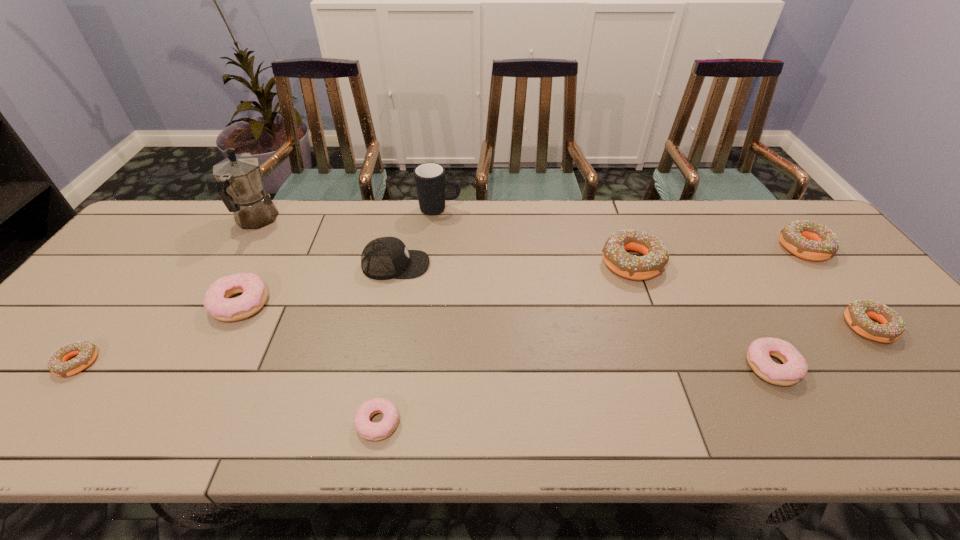
You are a GUI agent. You are given a task and a screenshot of the screen. Output one action in this format:
    pyautogui.click(x=<x>, y=<y>)
    Task: Click on the vacant region between the nearest doughnut and the second nearest chocolate doughnut
    This screenshot has width=960, height=540.
    Given the screenshot: What is the action you would take?
    pyautogui.click(x=623, y=375)

At what (x,y) coordinates should I click in order to perform the action: click on vacant area that lies between the tallest object and the mug. Please return your answer as a coordinate pair (x, y). Looking at the image, I should click on (348, 215).

Find the location of `unoccupied position between the biggest pink doughnut and the biggest chocolate doughnut`. unoccupied position between the biggest pink doughnut and the biggest chocolate doughnut is located at coordinates (436, 283).

This screenshot has width=960, height=540. I want to click on free space between the nearest doughnut and the eighth object from left to right, so click(574, 394).

Find the location of a particular element. Image resolution: width=960 pixels, height=540 pixels. free space between the third object from right to left and the eighth shortest object is located at coordinates (584, 315).

Locate which object is the fifth closest to the smallest pink doughnut. Please provide its 2D coordinates. Your answer should be formatted as a tuple, i.e. [(x, y)], where the tuple contains the x and y coordinates of a point satisfying the conditions above.

[(430, 180)]

This screenshot has height=540, width=960. I want to click on object that stands as the seventh closest to the second smallest pink doughnut, so click(216, 301).

You are a GUI agent. You are given a task and a screenshot of the screen. Output one action in this format:
    pyautogui.click(x=<x>, y=<y>)
    Task: Click on the doughnut that is the fourth closest one to the tallest object
    
    Given the screenshot: What is the action you would take?
    pyautogui.click(x=656, y=256)

This screenshot has width=960, height=540. I want to click on the second closest doughnut relative to the farthest pink doughnut, so click(x=368, y=430).

Locate an element on the screen. This screenshot has height=540, width=960. the closest chocolate doughnut relative to the eighth shortest object is located at coordinates (656, 256).